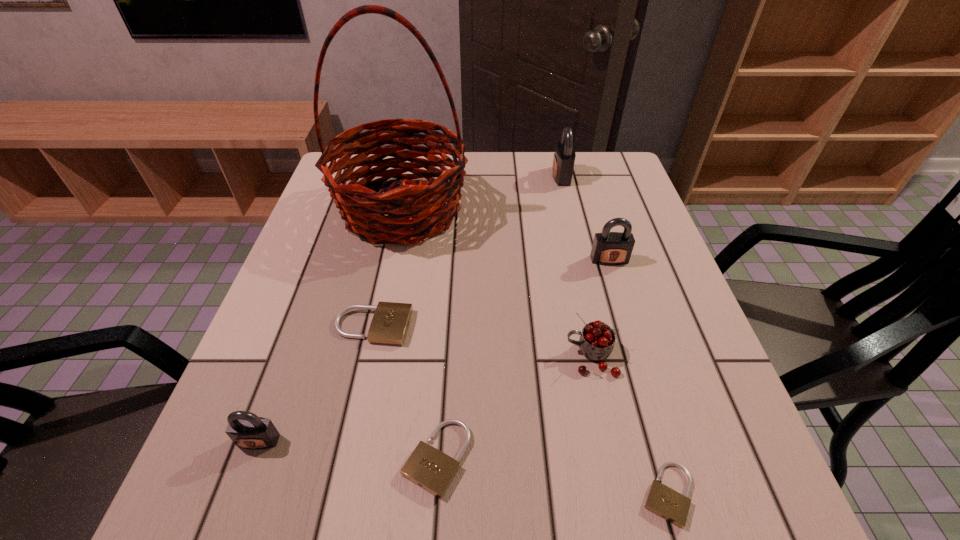
Choose which beige padlock is the third nearest neighbor to the biggest gray padlock. Please provide its 2D coordinates. Your answer should be formatted as a tuple, i.e. [(x, y)], where the tuple contains the x and y coordinates of a point satisfying the conditions above.

[(669, 504)]

Where is `beige padlock that is the third closest to the basket`? The image size is (960, 540). beige padlock that is the third closest to the basket is located at coordinates (669, 504).